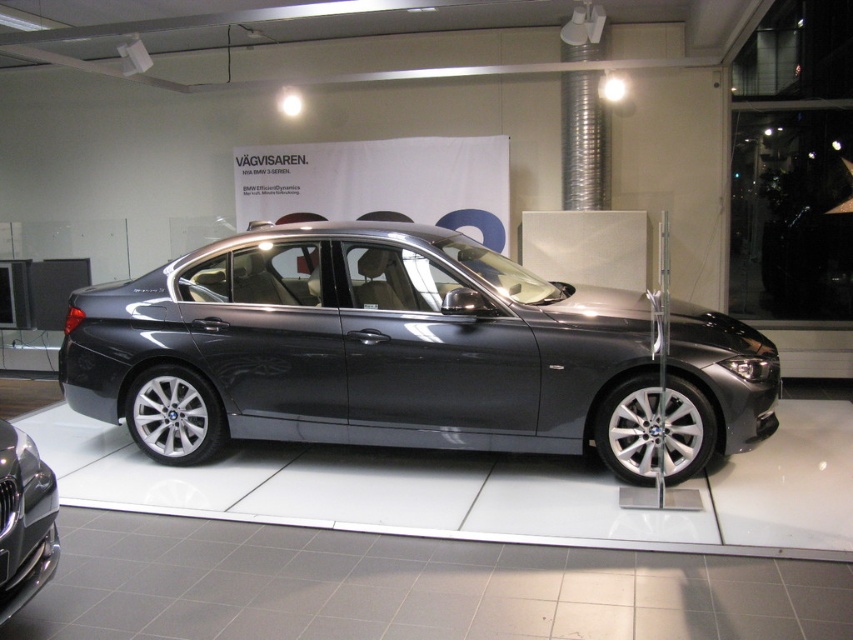
You are standing in the showroom and want to walk from point (570,435) to point (30,550). Which direction should you move to get closer to your destination?

Since point (570,435) is further to the viewer than point (30,550), you should move forward towards the display area to reach your destination.